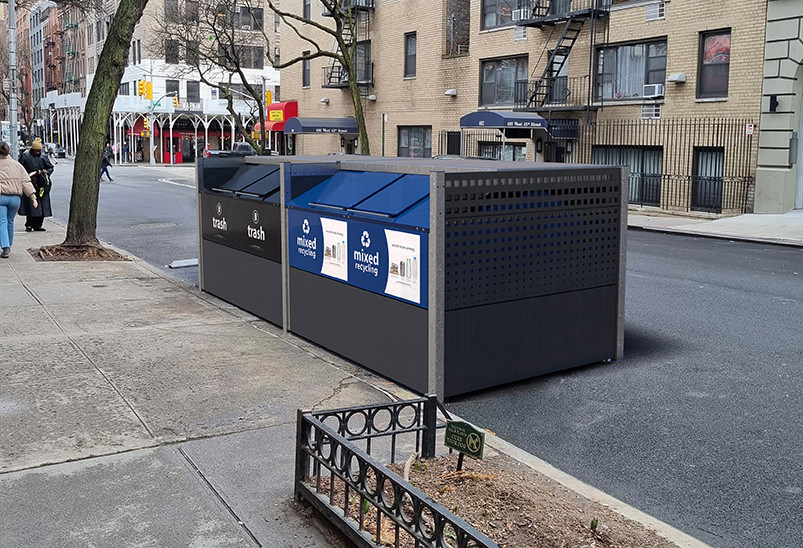
Where is `stairs`? The image size is (803, 548). stairs is located at coordinates (540, 4), (555, 55), (344, 50), (345, 4).